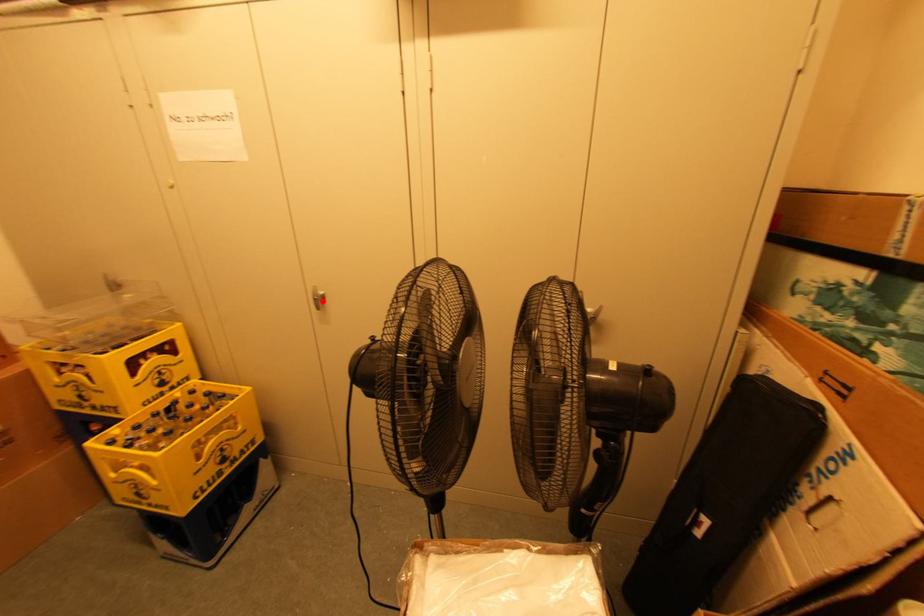
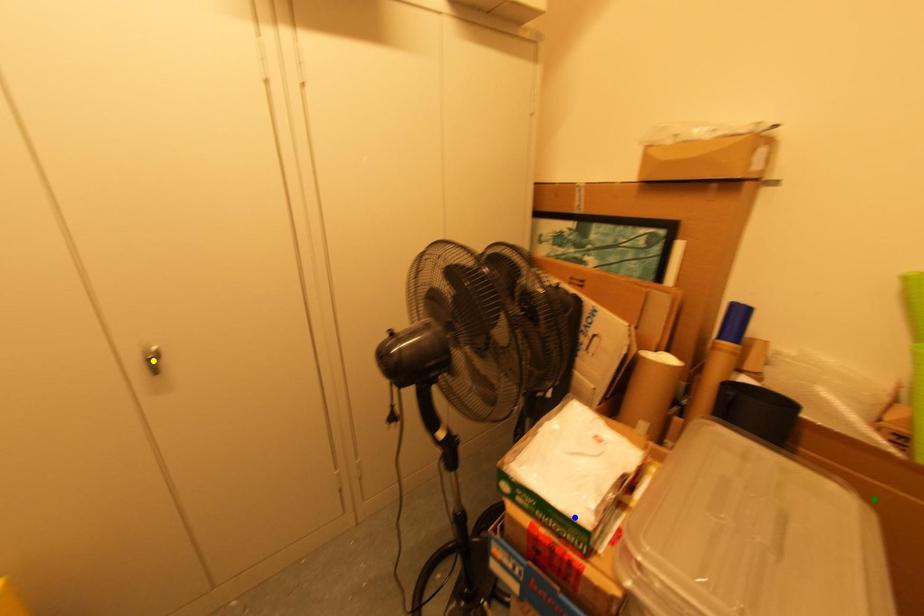
Question: I am providing you with two images of the same scene from different viewpoints. A red point is marked on the first image. You are given multiple points on the second image. Can you choose the point in image 2 that corresponds to the point in image 1?

Choices:
 (A) blue point
 (B) yellow point
 (C) green point

Answer: (B)